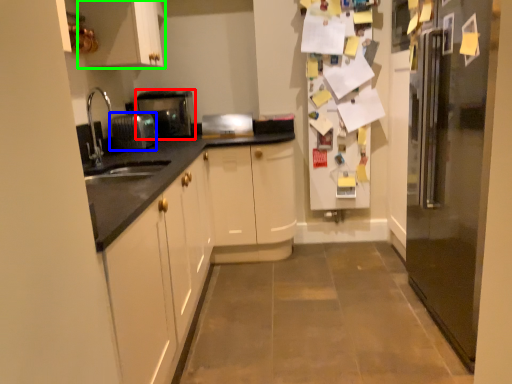
Question: Which object is positioned farthest from home appliance (highlighted by a red box)? Select from appliance (highlighted by a blue box) and cabinetry (highlighted by a green box).

Choices:
 (A) appliance
 (B) cabinetry

Answer: (B)